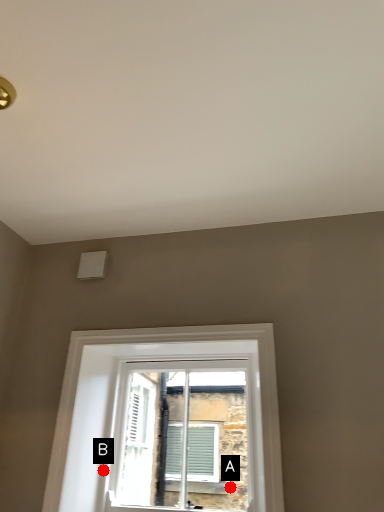
Question: Two points are circled on the image, labeled by A and B beside each circle. Which of the following is the farthest from the observer?

Choices:
 (A) A is further
 (B) B is further

Answer: (A)